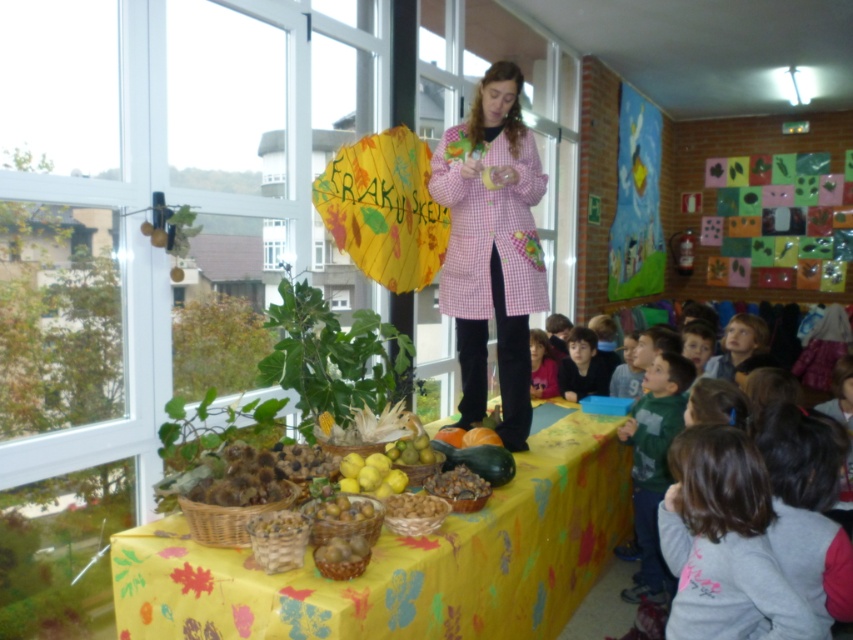
You are an attendee at the presentation and want to know which object is above the other between the brown hair at upper right and the yellow matte lemon at center. Can you tell me which one is above?

The brown hair at upper right is positioned over yellow matte lemon at center, so the brown hair at upper right is above the yellow matte lemon at center.

You are a photographer trying to capture a closeup shot of the yellow matte lemon at center without including the brown hair at upper right in the frame. Given their relative heights, is this possible?

The brown hair at upper right is taller than the yellow matte lemon at center, so it might be challenging to capture the lemon without the hair appearing in the frame unless you adjust your angle or position to lower your viewpoint.

You are a photographer trying to capture the presentation. You notice two points in the image at coordinates point (635, 420) and point (415, 461). Which point is closer to your camera lens?

Point (415, 461) is closer to the camera lens because it is less further away than point (635, 420), which is further away from the camera.